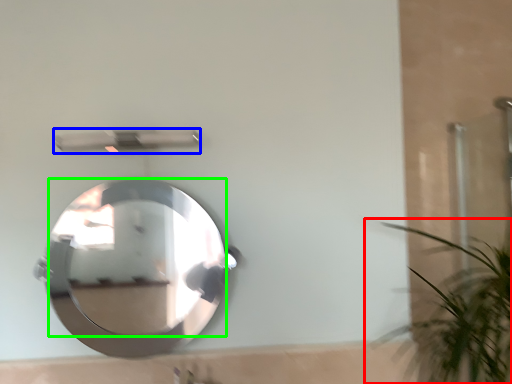
Question: Based on their relative distances, which object is nearer to houseplant (highlighted by a red box)? Choose from shower (highlighted by a blue box) and mirror (highlighted by a green box).

Choices:
 (A) shower
 (B) mirror

Answer: (A)